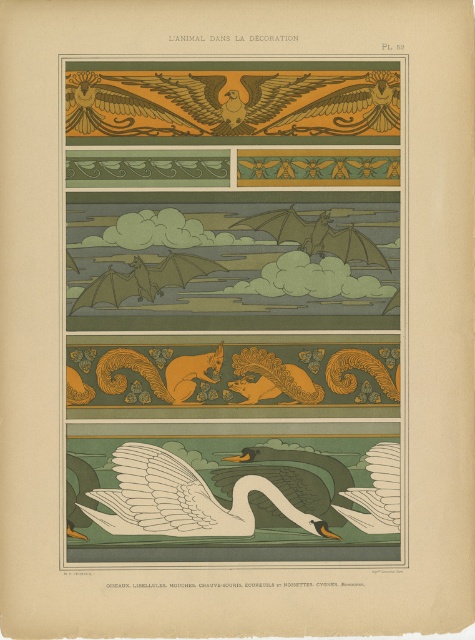
Is matte gold eagle at upper center thinner than gold metallic eagle at upper center?

In fact, matte gold eagle at upper center might be wider than gold metallic eagle at upper center.

What do you see at coordinates (231, 316) in the screenshot? The height and width of the screenshot is (640, 475). I see `matte gold eagle at upper center` at bounding box center [231, 316].

Where is `matte gold eagle at upper center`? This screenshot has height=640, width=475. matte gold eagle at upper center is located at coordinates (231, 316).

Is white matte swan at bottom center to the left of gold metallic eagle at upper center from the viewer's perspective?

Yes, white matte swan at bottom center is to the left of gold metallic eagle at upper center.

From the picture: Which is above, white matte swan at bottom center or gold metallic eagle at upper center?

gold metallic eagle at upper center is above.

Does point (180, 484) come behind point (333, 118)?

No.

Locate an element on the screen. white matte swan at bottom center is located at coordinates (188, 499).

Find the location of a particular element. matte gold eagle at upper center is located at coordinates (231, 316).

Is matte gold eagle at upper center to the right of white matte swan at bottom center from the viewer's perspective?

Indeed, matte gold eagle at upper center is positioned on the right side of white matte swan at bottom center.

This screenshot has width=475, height=640. What do you see at coordinates (231, 316) in the screenshot? I see `matte gold eagle at upper center` at bounding box center [231, 316].

I want to click on matte gold eagle at upper center, so click(231, 316).